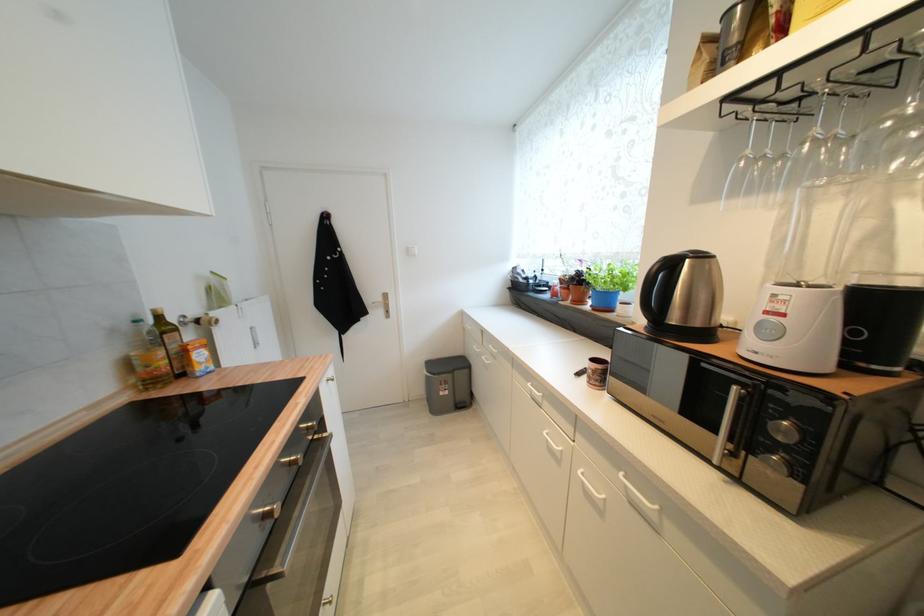
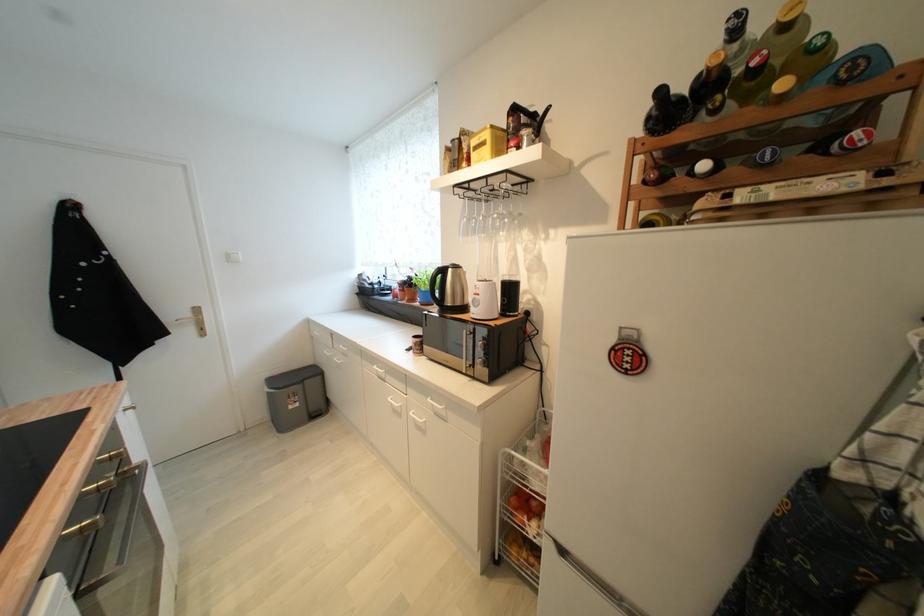
Find the pixel in the second image that matches (787,317) in the first image.

(483, 296)